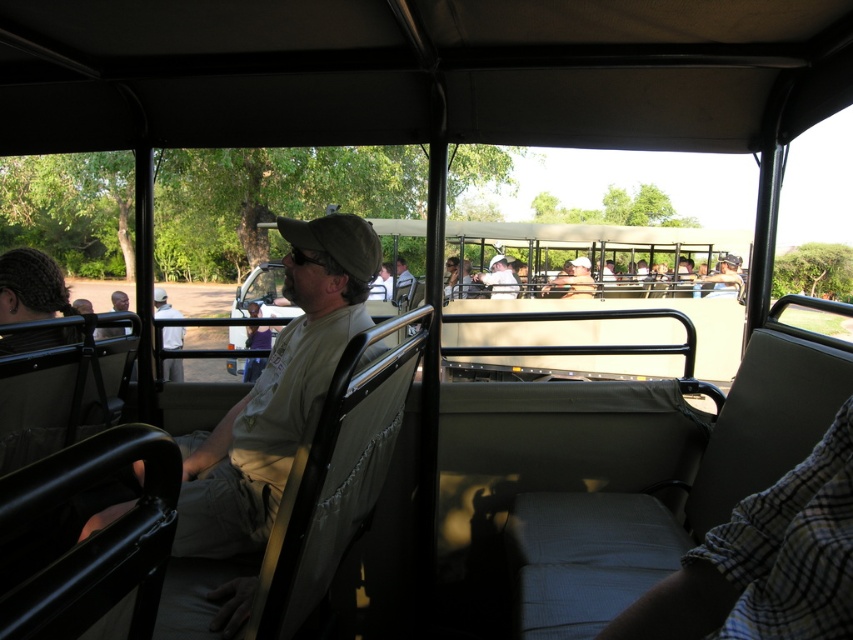
Question: Is khaki fabric shirt at center below matte khaki shirt at center?

Choices:
 (A) yes
 (B) no

Answer: (A)

Question: Which object is the closest to the matte khaki shirt at center?

Choices:
 (A) light brown leather jacket at center
 (B) khaki fabric shirt at center

Answer: (A)

Question: Is light brown leather jacket at center further to camera compared to matte khaki shirt at center?

Choices:
 (A) no
 (B) yes

Answer: (A)

Question: Which of the following is the closest to the observer?

Choices:
 (A) (508, 276)
 (B) (344, 253)

Answer: (B)

Question: Can you confirm if light brown leather jacket at center is positioned to the left of matte khaki shirt at center?

Choices:
 (A) no
 (B) yes

Answer: (B)

Question: Which point is farther from the camera taking this photo?

Choices:
 (A) (166, 371)
 (B) (505, 268)
 (C) (300, 368)

Answer: (B)